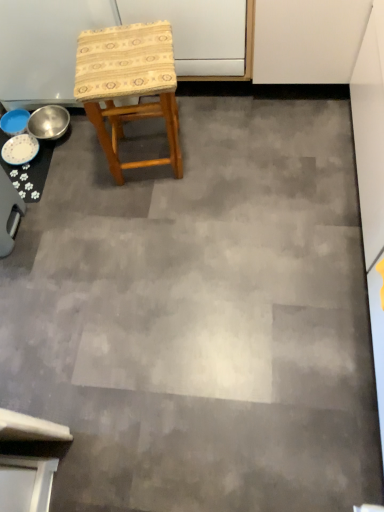
Locate an element on the screen. This screenshot has width=384, height=512. vacant space in woven fabric stool at center (from a real-world perspective) is located at coordinates (154, 169).